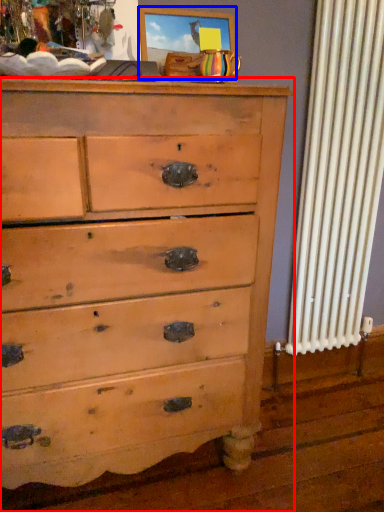
Question: Which of the following is the closest to the observer, chest of drawers (highlighted by a red box) or picture frame (highlighted by a blue box)?

Choices:
 (A) chest of drawers
 (B) picture frame

Answer: (A)